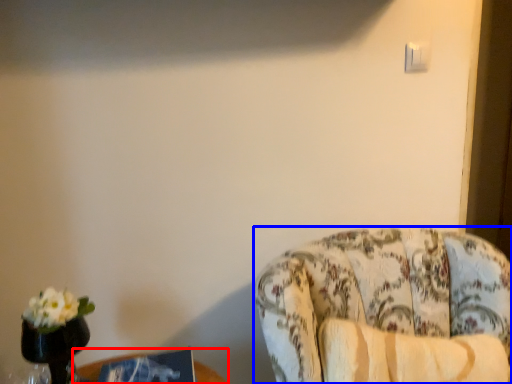
Question: Which point is further to the camera, table (highlighted by a red box) or chair (highlighted by a blue box)?

Choices:
 (A) table
 (B) chair

Answer: (A)